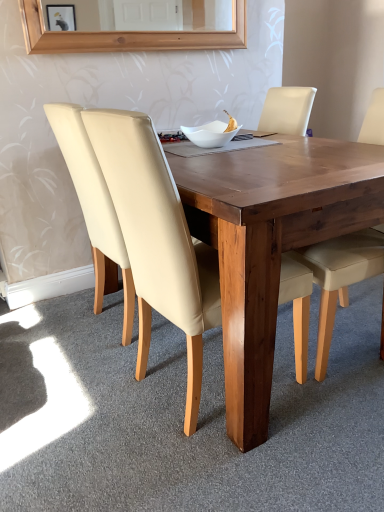
The image size is (384, 512). In order to click on free point in front of white glossy bowl at center in this screenshot , I will do `click(245, 155)`.